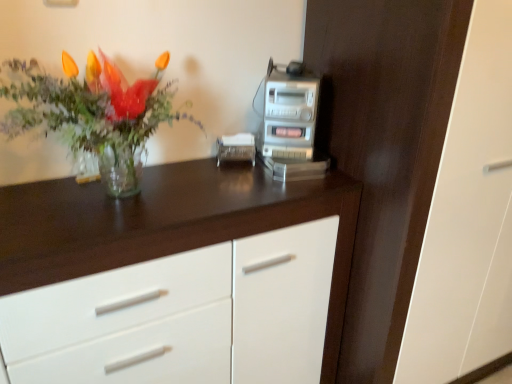
Question: Considering the positions of dark wood dresser at center and transparent glass vase at left in the image, is dark wood dresser at center bigger or smaller than transparent glass vase at left?

Choices:
 (A) small
 (B) big

Answer: (B)

Question: In the image, is dark wood dresser at center on the left side or the right side of transparent glass vase at left?

Choices:
 (A) left
 (B) right

Answer: (B)

Question: Considering the real-world distances, which object is farthest from the dark wood dresser at center?

Choices:
 (A) silver metallic stereo at upper right
 (B) transparent glass vase at left
 (C) white glossy chest of drawers at center

Answer: (B)

Question: Estimate the real-world distances between objects in this image. Which object is farther from the silver metallic stereo at upper right?

Choices:
 (A) white glossy chest of drawers at center
 (B) dark wood dresser at center
 (C) transparent glass vase at left

Answer: (C)